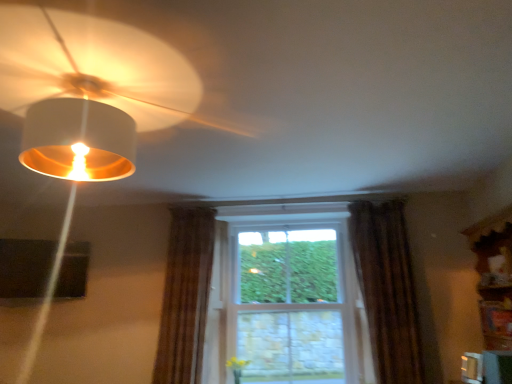
Question: From a real-world perspective, is clear glass window at center positioned under matte white lampshade at upper left based on gravity?

Choices:
 (A) yes
 (B) no

Answer: (A)

Question: Is matte white lampshade at upper left completely or partially inside clear glass window at center?

Choices:
 (A) no
 (B) yes

Answer: (A)

Question: Is clear glass window at center shorter than matte white lampshade at upper left?

Choices:
 (A) no
 (B) yes

Answer: (A)

Question: Is clear glass window at center directly adjacent to matte white lampshade at upper left?

Choices:
 (A) no
 (B) yes

Answer: (A)

Question: Considering the relative sizes of clear glass window at center and matte white lampshade at upper left in the image provided, is clear glass window at center bigger than matte white lampshade at upper left?

Choices:
 (A) no
 (B) yes

Answer: (B)

Question: From the image's perspective, relative to clear glass window at center, is brown textured curtain at center, placed as the first curtain when sorted from left to right, above or below?

Choices:
 (A) above
 (B) below

Answer: (A)

Question: Considering the positions of brown textured curtain at center, placed as the first curtain when sorted from left to right, and clear glass window at center in the image, is brown textured curtain at center, placed as the first curtain when sorted from left to right, bigger or smaller than clear glass window at center?

Choices:
 (A) big
 (B) small

Answer: (B)

Question: From a real-world perspective, relative to clear glass window at center, is brown textured curtain at center, the 2th curtain viewed from the right, vertically above or below?

Choices:
 (A) below
 (B) above

Answer: (B)

Question: Based on their positions, is brown textured curtain at center, the 2th curtain viewed from the right, located to the left or right of clear glass window at center?

Choices:
 (A) right
 (B) left

Answer: (B)

Question: Is matte white lampshade at upper left in front of or behind brown textured curtain at right, which appears as the second curtain when viewed from the left, in the image?

Choices:
 (A) behind
 (B) front

Answer: (B)

Question: Considering the positions of matte white lampshade at upper left and brown textured curtain at right, arranged as the 1th curtain when viewed from the right, in the image, is matte white lampshade at upper left bigger or smaller than brown textured curtain at right, arranged as the 1th curtain when viewed from the right,?

Choices:
 (A) big
 (B) small

Answer: (B)

Question: From a real-world perspective, relative to brown textured curtain at right, which appears as the second curtain when viewed from the left, is matte white lampshade at upper left vertically above or below?

Choices:
 (A) below
 (B) above

Answer: (B)

Question: In the image, is matte white lampshade at upper left on the left side or the right side of brown textured curtain at right, which appears as the second curtain when viewed from the left?

Choices:
 (A) right
 (B) left

Answer: (B)

Question: In terms of size, does brown textured curtain at right, arranged as the 1th curtain when viewed from the right, appear bigger or smaller than brown textured curtain at center, the 2th curtain viewed from the right?

Choices:
 (A) big
 (B) small

Answer: (A)

Question: Considering the relative positions of brown textured curtain at right, arranged as the 1th curtain when viewed from the right, and brown textured curtain at center, placed as the first curtain when sorted from left to right, in the image provided, is brown textured curtain at right, arranged as the 1th curtain when viewed from the right, to the left or to the right of brown textured curtain at center, placed as the first curtain when sorted from left to right,?

Choices:
 (A) left
 (B) right

Answer: (B)